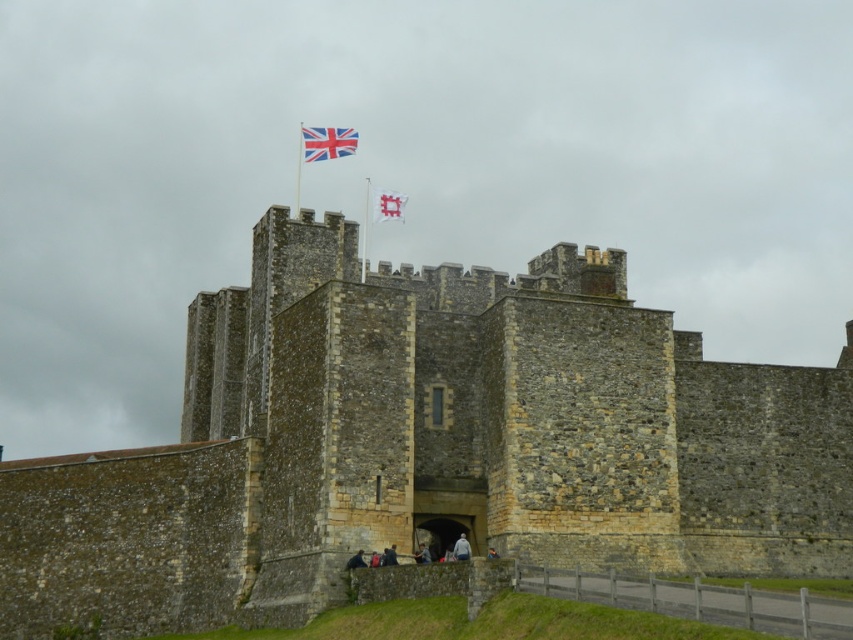
You are a castle architect planning to add a decorative element between the stone wall at center and the british flag at top center. Which object is wider so that the decorative element can be placed on the narrower side?

The stone wall at center is wider than the british flag at top center, so the decorative element should be placed on the narrower side of the british flag at top center.

You are a visitor standing at the base of the castle and want to take a photo of both the british flag at top center and the white fabric flag at upper center. Which flag should you point your camera towards first to ensure both are in frame?

The british flag at top center is to the left of white fabric flag at upper center, so you should point your camera towards the british flag at top center first to capture both in the frame.

You are standing in front of the historic stone castle and want to touch the stone wall at center. Given that you are at the origin point, can you reach it directly without moving past the castle gates?

The stone wall at center is located at point (427, 444), which is within the castle grounds, so you can reach it directly without moving past the castle gates.